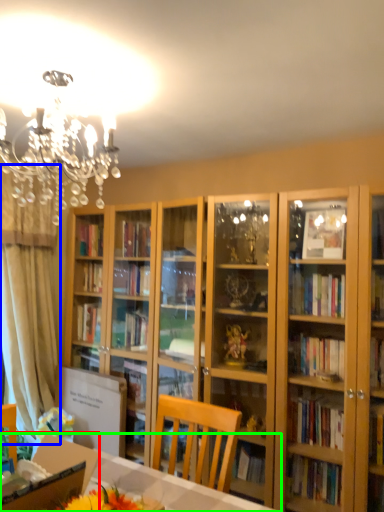
Question: Based on their relative distances, which object is nearer to cardboard box (highlighted by a red box)? Choose from curtain (highlighted by a blue box) and desk (highlighted by a green box).

Choices:
 (A) curtain
 (B) desk

Answer: (B)